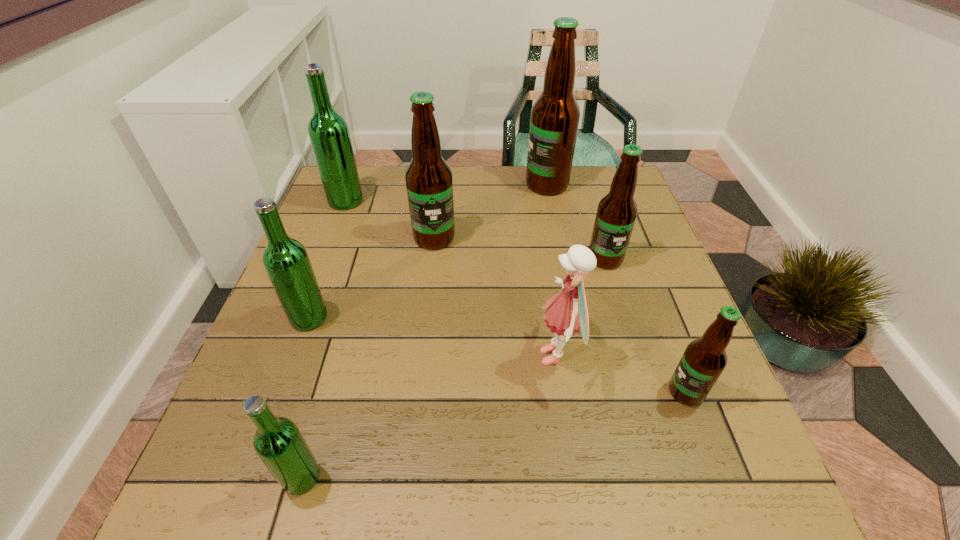
At what (x,y) coordinates should I click in order to perform the action: click on the sixth farthest beer bottle. Please return your answer as a coordinate pair (x, y). Looking at the image, I should click on (703, 361).

Identify the location of the nearest green beer bottle. Image resolution: width=960 pixels, height=540 pixels. (278, 442).

Locate an element on the screen. The width and height of the screenshot is (960, 540). the third object from left to right is located at coordinates (278, 442).

In order to click on blank space located 0.230m on the label of the biggest brown beer bottle in this screenshot , I will do `click(449, 185)`.

Locate an element on the screen. vacant space located on the label of the biggest brown beer bottle is located at coordinates (406, 185).

Find the location of a particular element. vacant space located on the label of the biggest brown beer bottle is located at coordinates (449, 185).

Locate an element on the screen. free space located 0.150m on the right of the biggest green beer bottle is located at coordinates (416, 201).

Identify the location of free space located on the label of the third smallest brown beer bottle. (420, 352).

The width and height of the screenshot is (960, 540). Identify the location of vacant space located 0.150m on the label of the third biggest brown beer bottle. (623, 318).

The image size is (960, 540). I want to click on free region located on the right of the second smallest green beer bottle, so click(434, 318).